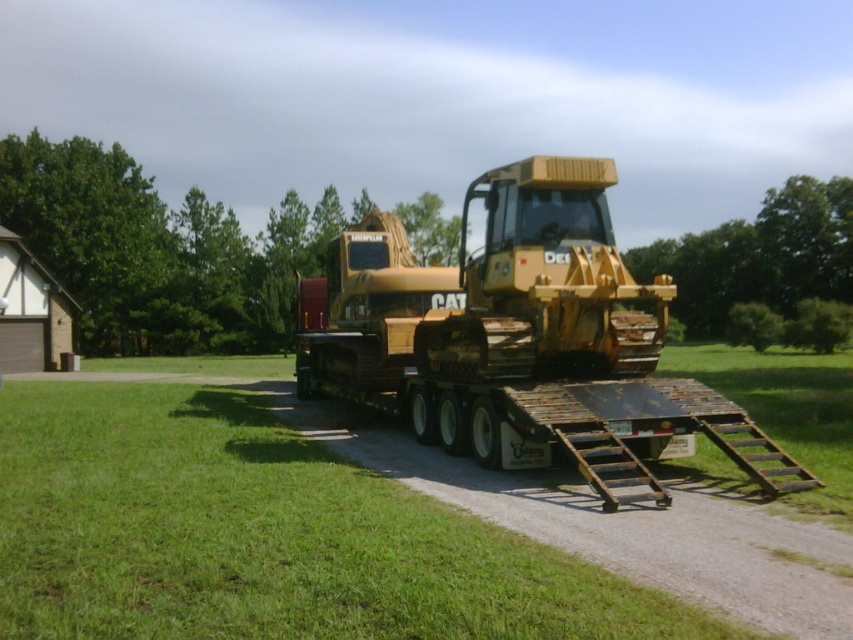
Question: Among these objects, which one is nearest to the camera?

Choices:
 (A) yellow metallic tractor at center
 (B) green grass at lower left

Answer: (B)

Question: Can you confirm if green grass at lower left is positioned above yellow metallic tractor at center?

Choices:
 (A) no
 (B) yes

Answer: (A)

Question: Which object appears farthest from the camera in this image?

Choices:
 (A) yellow metallic tractor at center
 (B) green grass at lower left

Answer: (A)

Question: Can you confirm if green grass at lower left is thinner than yellow metallic tractor at center?

Choices:
 (A) no
 (B) yes

Answer: (A)

Question: Is green grass at lower left smaller than yellow metallic tractor at center?

Choices:
 (A) no
 (B) yes

Answer: (A)